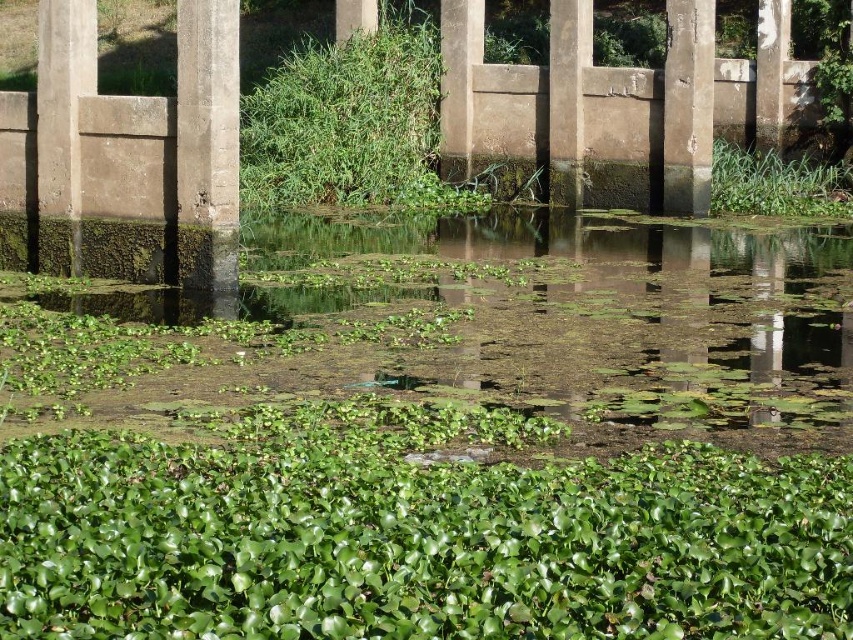
Question: Among these objects, which one is nearest to the camera?

Choices:
 (A) green leafy plant at right
 (B) smooth concrete pillar at right

Answer: (B)

Question: Is smooth concrete pillar at right bigger than green leafy plant at right?

Choices:
 (A) yes
 (B) no

Answer: (B)

Question: Can you confirm if smooth concrete pillar at right is positioned above green leafy plant at right?

Choices:
 (A) yes
 (B) no

Answer: (A)

Question: Does smooth concrete pillar at right have a smaller size compared to green leafy plant at right?

Choices:
 (A) yes
 (B) no

Answer: (A)